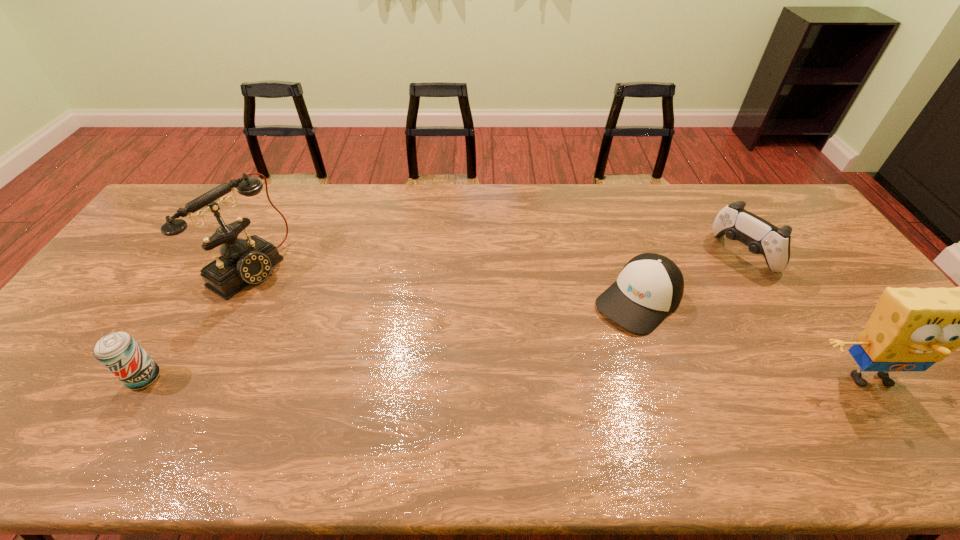
Locate an element on the screen. Image resolution: width=960 pixels, height=540 pixels. beer can is located at coordinates (119, 352).

The image size is (960, 540). What are the coordinates of `sponge` in the screenshot? It's located at (911, 329).

This screenshot has width=960, height=540. In order to click on the third object from right to left in this screenshot , I will do `click(650, 286)`.

Find the location of a particular element. control is located at coordinates (761, 237).

At what (x,y) coordinates should I click in order to perform the action: click on telephone. Please return your answer as a coordinate pair (x, y). This screenshot has height=540, width=960. Looking at the image, I should click on (242, 262).

The image size is (960, 540). I want to click on vacant space located on the back of the beer can, so click(x=178, y=323).

Where is `free space located 0.290m on the front panel of the third object from left to right`? The height and width of the screenshot is (540, 960). free space located 0.290m on the front panel of the third object from left to right is located at coordinates (540, 391).

This screenshot has height=540, width=960. I want to click on blank space located on the front panel of the third object from left to right, so click(x=530, y=402).

Locate an element on the screen. Image resolution: width=960 pixels, height=540 pixels. free space located on the front panel of the third object from left to right is located at coordinates (536, 396).

Identify the location of free spot located on the front-facing side of the control. The width and height of the screenshot is (960, 540). (644, 324).